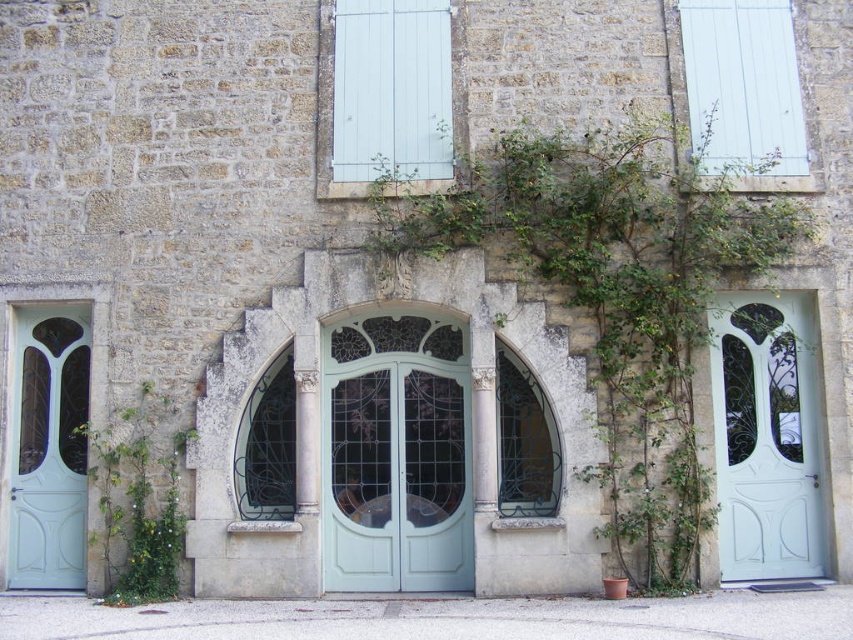
Question: Considering the relative positions of green leafy plant at center and green glass window at center in the image provided, where is green leafy plant at center located with respect to green glass window at center?

Choices:
 (A) left
 (B) right

Answer: (B)

Question: Among these points, which one is nearest to the camera?

Choices:
 (A) (555, 481)
 (B) (781, 58)
 (C) (129, 451)

Answer: (C)

Question: Which object appears farthest from the camera in this image?

Choices:
 (A) dark glass window at center
 (B) white painted wood shutters at upper right

Answer: (B)

Question: Which object is positioned farthest from the light green wood door at center?

Choices:
 (A) light blue glass door at left
 (B) dark glass window at center

Answer: (A)

Question: From the image, what is the correct spatial relationship of light blue matte door at right in relation to white painted wood shutters at upper right?

Choices:
 (A) right
 (B) left

Answer: (A)

Question: Does light blue glass door at left come behind green glass window at center?

Choices:
 (A) yes
 (B) no

Answer: (A)